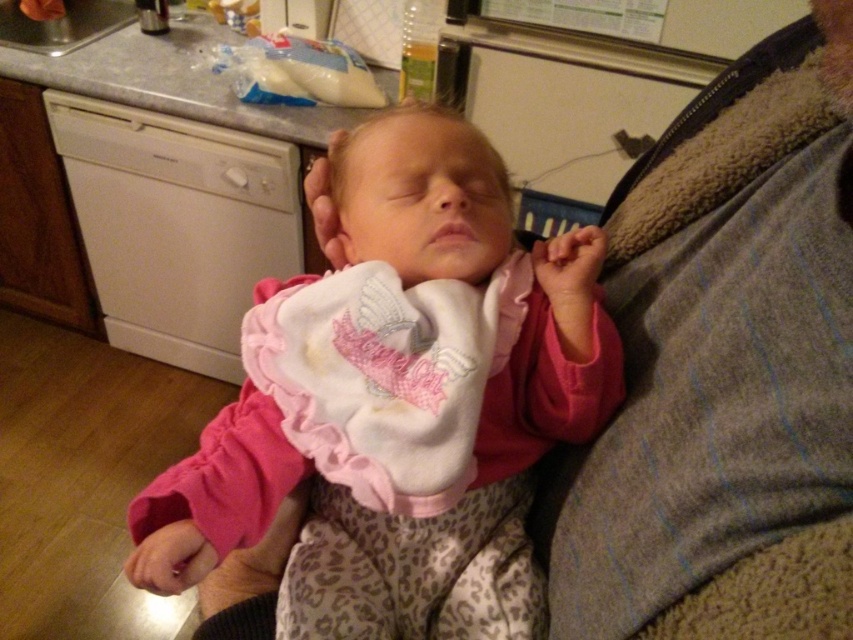
Question: Is pink fleece baby at center to the left of white soft bib at center from the viewer's perspective?

Choices:
 (A) no
 (B) yes

Answer: (A)

Question: Can you confirm if pink fleece baby at center is bigger than white soft bib at center?

Choices:
 (A) no
 (B) yes

Answer: (B)

Question: Can you confirm if pink fleece baby at center is thinner than white soft bib at center?

Choices:
 (A) no
 (B) yes

Answer: (A)

Question: Which point is closer to the camera?

Choices:
 (A) (248, 328)
 (B) (402, 204)

Answer: (B)